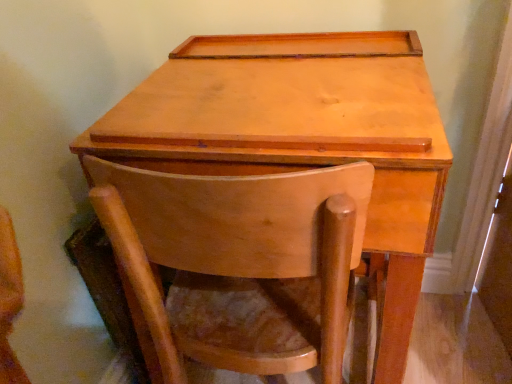
Question: From the image's perspective, relative to light brown wood table at center, is matte wood chair at center above or below?

Choices:
 (A) below
 (B) above

Answer: (A)

Question: Choose the correct answer: Is matte wood chair at center inside light brown wood table at center or outside it?

Choices:
 (A) inside
 (B) outside

Answer: (A)

Question: From a real-world perspective, is matte wood chair at center positioned above or below light brown wood table at center?

Choices:
 (A) below
 (B) above

Answer: (A)

Question: Considering the positions of light brown wood table at center and matte wood chair at center in the image, is light brown wood table at center wider or thinner than matte wood chair at center?

Choices:
 (A) thin
 (B) wide

Answer: (B)

Question: Considering the relative positions of light brown wood table at center and matte wood chair at center in the image provided, is light brown wood table at center to the left or to the right of matte wood chair at center?

Choices:
 (A) left
 (B) right

Answer: (B)

Question: Is light brown wood table at center spatially inside matte wood chair at center, or outside of it?

Choices:
 (A) outside
 (B) inside

Answer: (B)

Question: From the image's perspective, is light brown wood table at center above or below matte wood chair at center?

Choices:
 (A) below
 (B) above

Answer: (B)